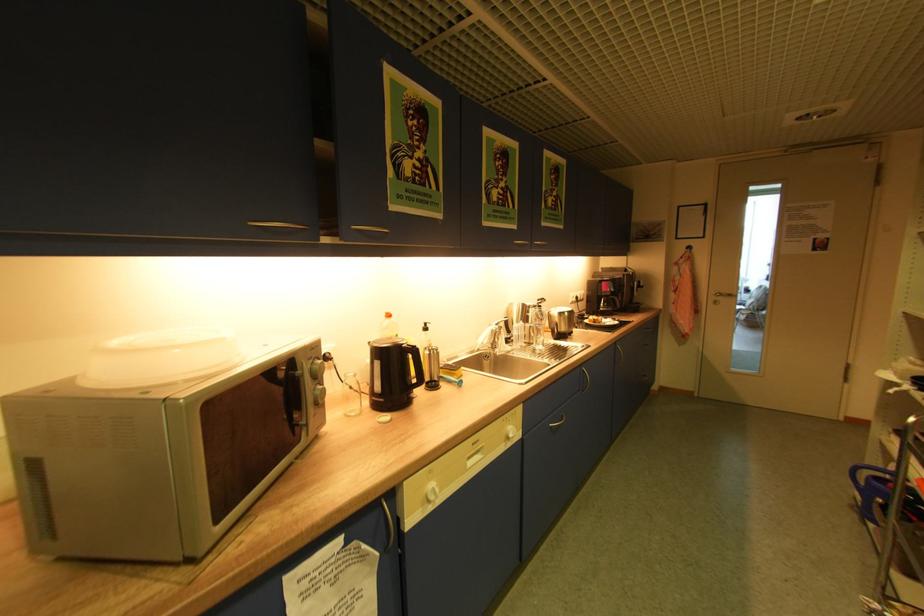
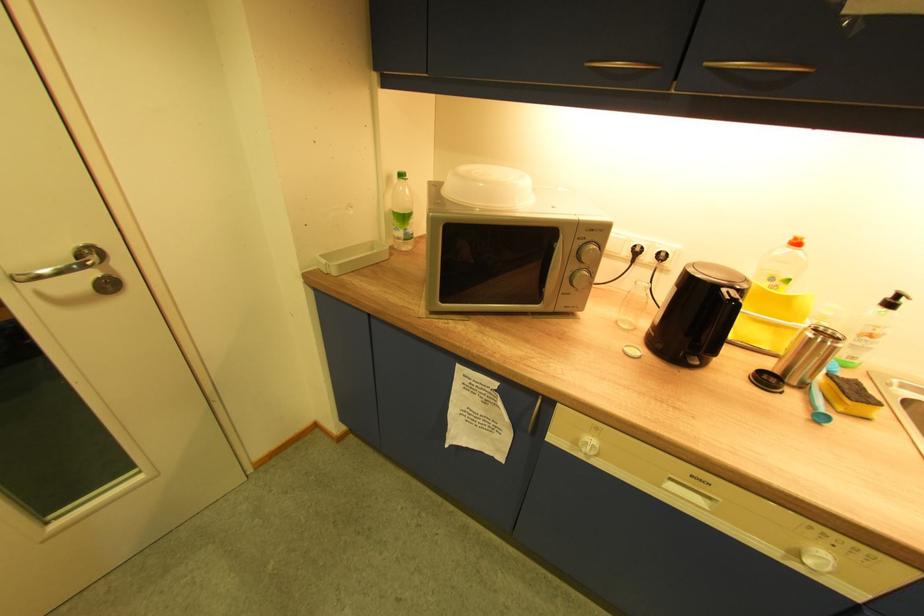
Locate, in the second image, the point that corresponds to point (517, 437) in the first image.

(812, 562)